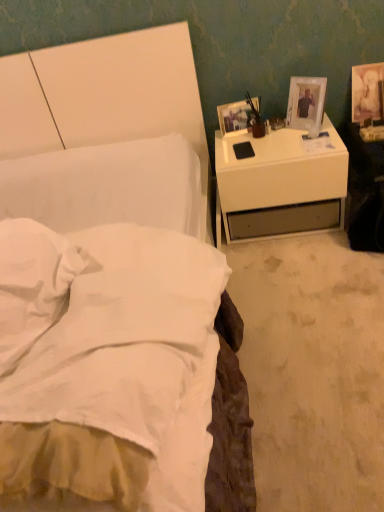
Identify the location of empty space that is ontop of white glossy nightstand at right (from a real-world perspective). Image resolution: width=384 pixels, height=512 pixels. (271, 136).